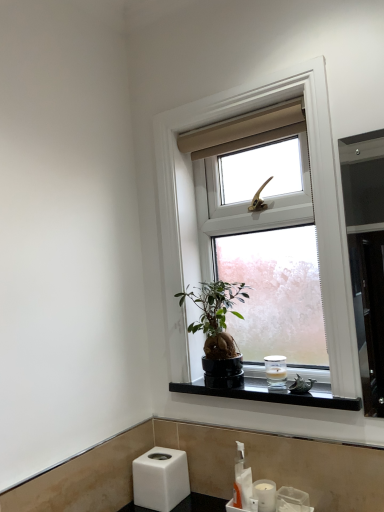
Identify the location of free spot behind metallic silver bird at window. Image resolution: width=384 pixels, height=512 pixels. (290, 384).